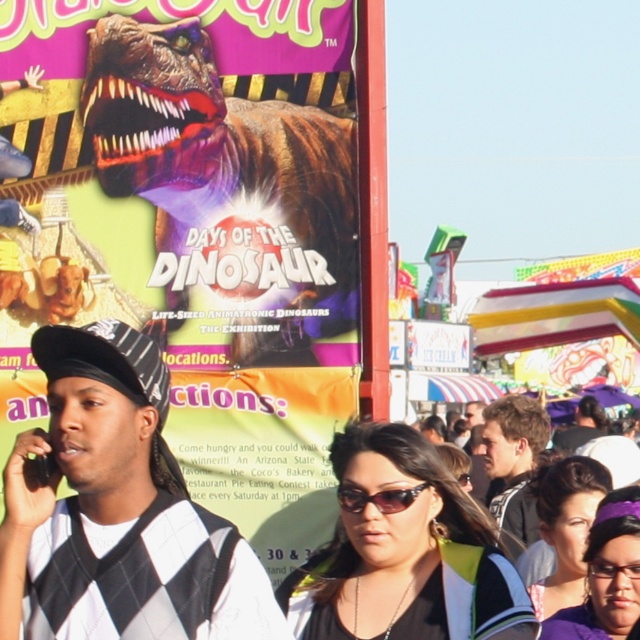
You are at the fair and want to take a photo of the dinosaur advertisement. You notice two points on the poster. Which point, point 1 at coordinates (392, 550) or point 2 at coordinates (358, 502), is closer to you when standing in front of the poster?

Point 1 at coordinates (392, 550) is closer to the viewer than point 2 at coordinates (358, 502).